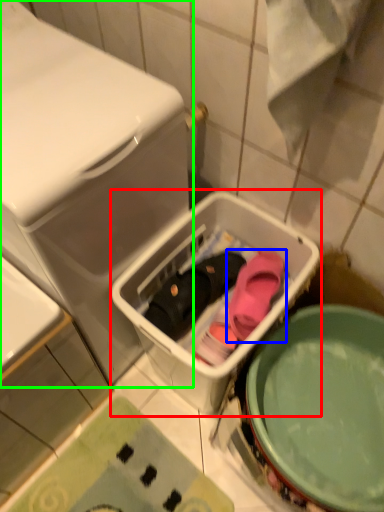
Question: Based on their relative distances, which object is farther from dish washer (highlighted by a red box)? Choose from footwear (highlighted by a blue box) and dish washer (highlighted by a green box).

Choices:
 (A) footwear
 (B) dish washer

Answer: (B)